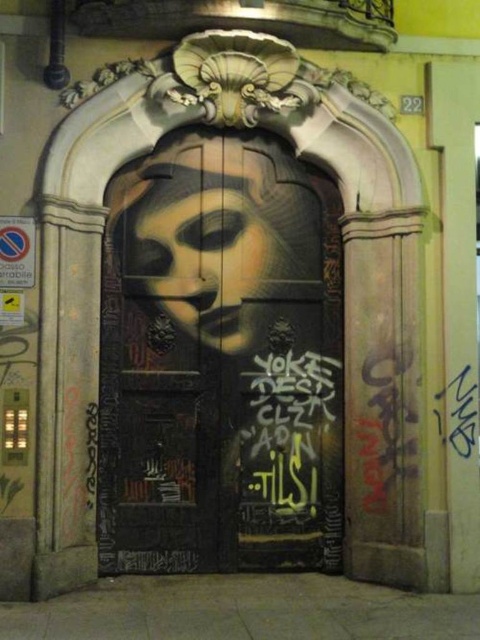
Can you confirm if matte black door at center is smaller than black graffiti at center?

No.

Based on the photo, can you confirm if matte black door at center is bigger than black graffiti at center?

Correct, matte black door at center is larger in size than black graffiti at center.

Does point (208, 534) come closer to viewer compared to point (433, 396)?

No, (208, 534) is behind (433, 396).

The height and width of the screenshot is (640, 480). I want to click on matte black door at center, so click(x=220, y=360).